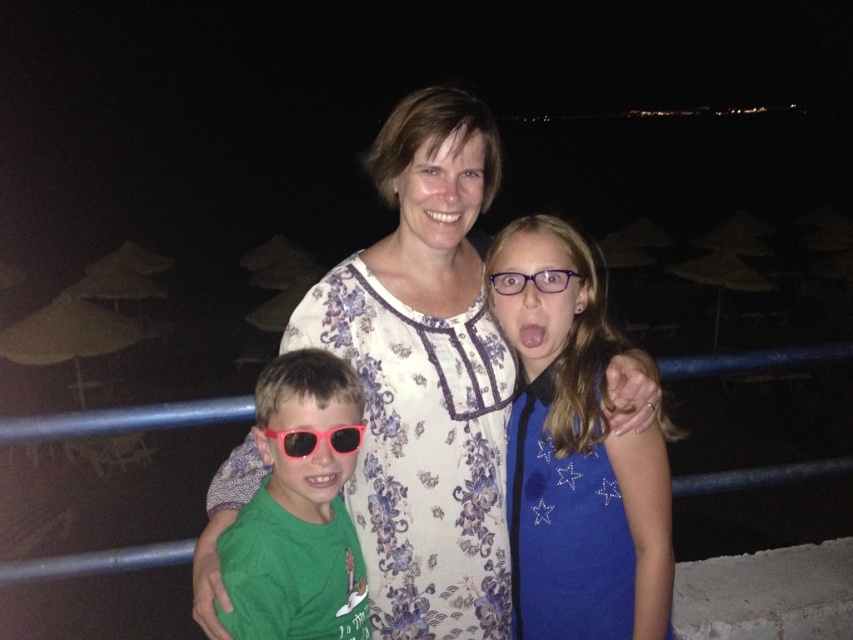
Who is more forward, (328, 292) or (339, 419)?

Point (339, 419)

Is point (483, 152) closer to camera compared to point (267, 451)?

No, it is behind (267, 451).

The height and width of the screenshot is (640, 853). Find the location of `white floral dress at center`. white floral dress at center is located at coordinates (425, 376).

Is white floral dress at center wider than pink plastic goggles at lower left?

Yes, white floral dress at center is wider than pink plastic goggles at lower left.

Does white floral dress at center have a larger size compared to pink plastic goggles at lower left?

Correct, white floral dress at center is larger in size than pink plastic goggles at lower left.

Which is in front, point (485, 444) or point (347, 432)?

Point (347, 432) is more forward.

I want to click on white floral dress at center, so click(x=425, y=376).

Who is positioned more to the right, floral cotton dress at center or green matte shirt at lower left?

From the viewer's perspective, floral cotton dress at center appears more on the right side.

Between floral cotton dress at center and green matte shirt at lower left, which one is positioned higher?

floral cotton dress at center is higher up.

Image resolution: width=853 pixels, height=640 pixels. I want to click on floral cotton dress at center, so (422, 452).